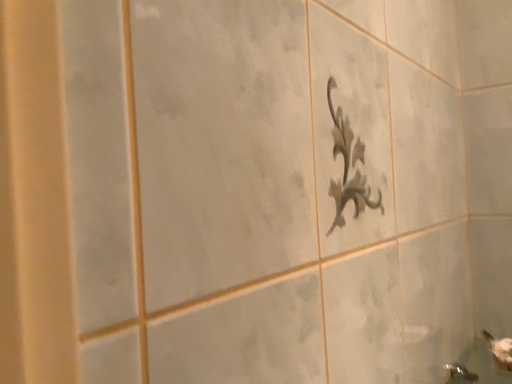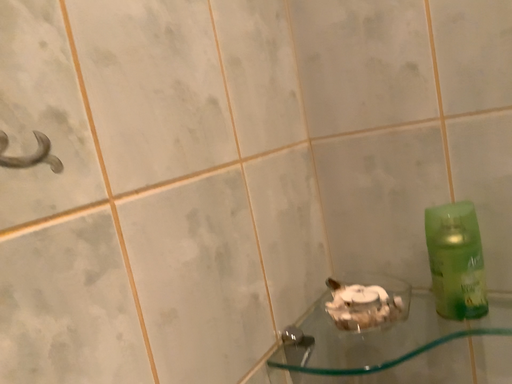
Question: Which way did the camera rotate in the video?

Choices:
 (A) rotated upward
 (B) rotated downward

Answer: (B)